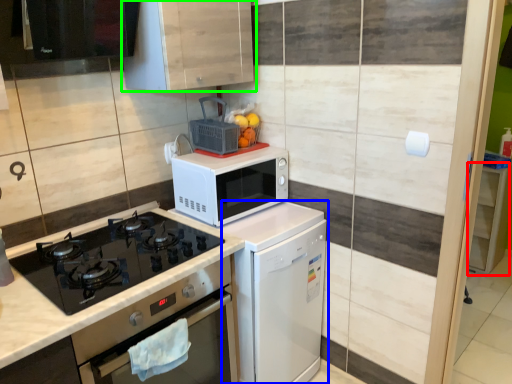
Question: Which object is positioned farthest from cabinetry (highlighted by a red box)? Select from dish washer (highlighted by a blue box) and cabinetry (highlighted by a green box).

Choices:
 (A) dish washer
 (B) cabinetry

Answer: (B)